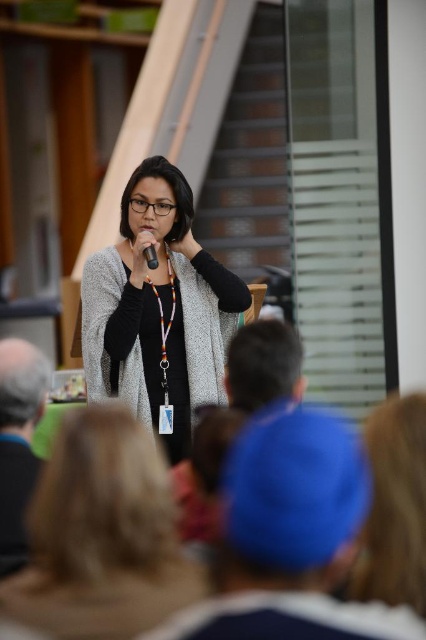
From the picture: You are a photographer in the audience taking a picture of the speaker. You notice the blonde hair at lower left and the black plastic microphone at center. Which object should you adjust your camera angle to avoid blocking the other?

The blonde hair at lower left is in front of the black plastic microphone at center, so you should adjust your camera angle to move the blonde hair at lower left out of the way to ensure the microphone is visible.

You are a photographer at the event and want to capture a closeup of the speaker while ensuring both the blue knit cap at lower center and the blue fabric cap at lower center are visible in the frame. Which cap should you position closer to the edge of the frame to avoid overcrowding?

The blue knit cap at lower center is wider than the blue fabric cap at lower center, so positioning the blue knit cap at lower center closer to the edge will help avoid overcrowding due to its larger size.